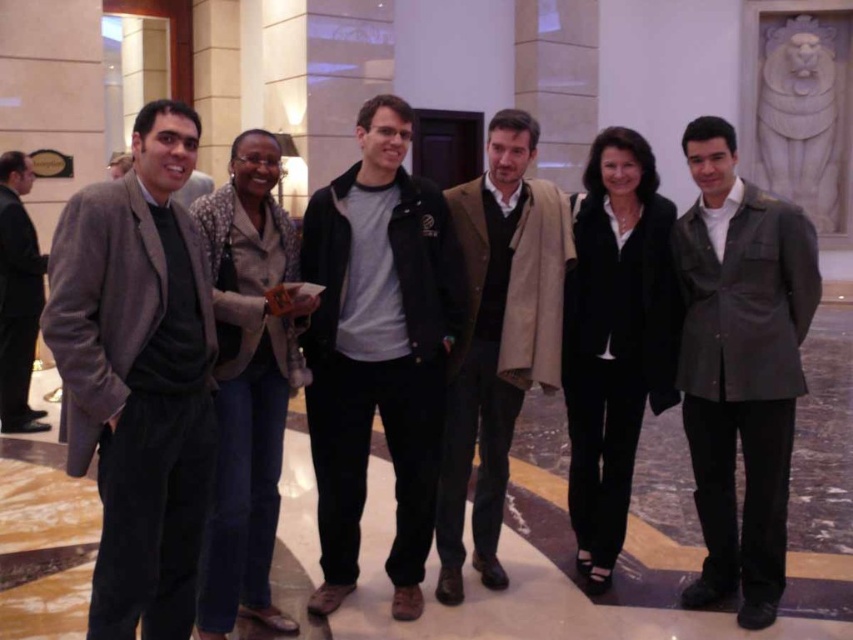
Question: Can you confirm if gray woolen blazer at left is bigger than brown woolen scarf at center?

Choices:
 (A) no
 (B) yes

Answer: (A)

Question: Is dark gray leather jacket at right closer to camera compared to brown woolen scarf at center?

Choices:
 (A) no
 (B) yes

Answer: (B)

Question: Can you confirm if black matte jacket at center is positioned to the left of black fabric business suit at center?

Choices:
 (A) no
 (B) yes

Answer: (B)

Question: Which point is farther to the camera?

Choices:
 (A) (115, 531)
 (B) (454, 394)

Answer: (B)

Question: Which point appears closest to the camera in this image?

Choices:
 (A) (735, 227)
 (B) (648, 225)

Answer: (A)

Question: Which of the following is the farthest from the observer?

Choices:
 (A) (590, 422)
 (B) (4, 243)
 (C) (782, 419)
 (D) (509, 145)

Answer: (B)